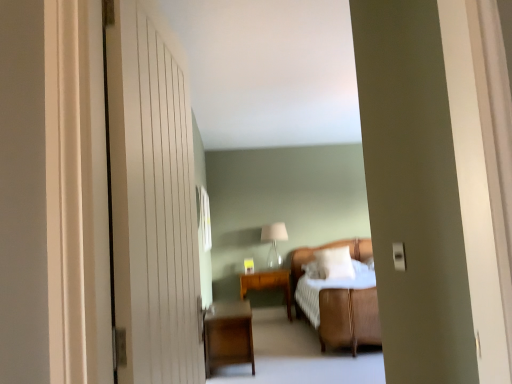
Question: From the image's perspective, would you say white soft pillow at center is positioned over wooden side table at center?

Choices:
 (A) no
 (B) yes

Answer: (B)

Question: Is white soft pillow at center facing towards wooden side table at center?

Choices:
 (A) yes
 (B) no

Answer: (B)

Question: Is white soft pillow at center further to camera compared to wooden side table at center?

Choices:
 (A) no
 (B) yes

Answer: (A)

Question: Would you say white soft pillow at center is a long distance from wooden side table at center?

Choices:
 (A) no
 (B) yes

Answer: (A)

Question: Is white soft pillow at center shorter than wooden side table at center?

Choices:
 (A) yes
 (B) no

Answer: (A)

Question: Considering the positions of white textured bed at center and wooden side table at center in the image, is white textured bed at center taller or shorter than wooden side table at center?

Choices:
 (A) tall
 (B) short

Answer: (A)

Question: Considering their positions, is white textured bed at center located in front of or behind wooden side table at center?

Choices:
 (A) behind
 (B) front

Answer: (B)

Question: In terms of width, does white textured bed at center look wider or thinner when compared to wooden side table at center?

Choices:
 (A) wide
 (B) thin

Answer: (A)

Question: Is white textured bed at center inside the boundaries of wooden side table at center, or outside?

Choices:
 (A) outside
 (B) inside

Answer: (A)

Question: Is white wooden door at left spatially inside white textured bed at center, or outside of it?

Choices:
 (A) outside
 (B) inside

Answer: (A)

Question: Based on their positions, is white wooden door at left located to the left or right of white textured bed at center?

Choices:
 (A) left
 (B) right

Answer: (A)

Question: From a real-world perspective, is white wooden door at left positioned above or below white textured bed at center?

Choices:
 (A) above
 (B) below

Answer: (A)

Question: Relative to white textured bed at center, is white wooden door at left in front or behind?

Choices:
 (A) behind
 (B) front

Answer: (B)

Question: From the image's perspective, is dark wood nightstand at lower left located above or below wooden side table at center?

Choices:
 (A) above
 (B) below

Answer: (A)

Question: Considering the positions of dark wood nightstand at lower left and wooden side table at center in the image, is dark wood nightstand at lower left bigger or smaller than wooden side table at center?

Choices:
 (A) big
 (B) small

Answer: (A)